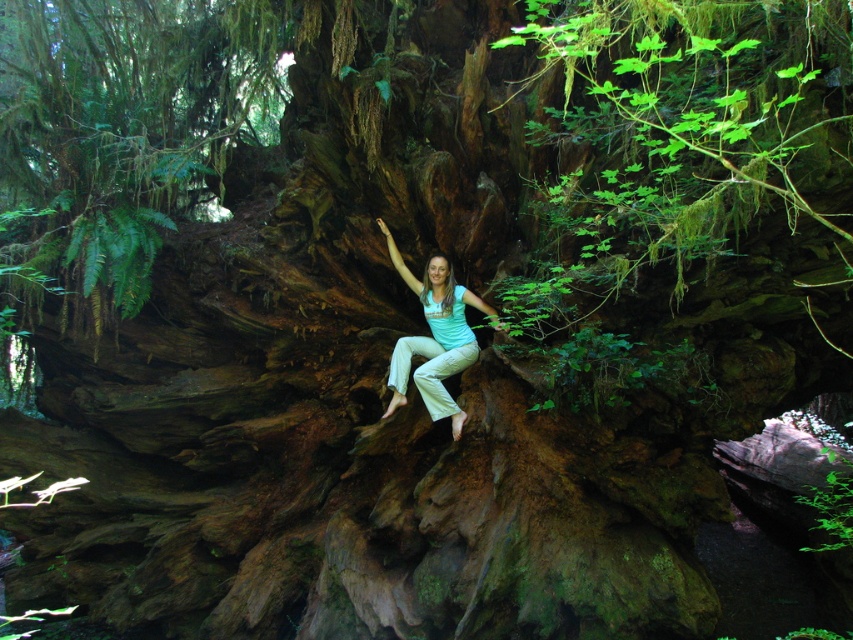
Is green mossy tree trunk at center positioned at the back of light blue cotton shirt at center?

No, it is in front of light blue cotton shirt at center.

Does point (97, 248) come farther from viewer compared to point (431, 294)?

That is False.

Between point (51, 180) and point (445, 273), which one is positioned in front?

Point (445, 273) is more forward.

At what (x,y) coordinates should I click in order to perform the action: click on green mossy tree trunk at center. Please return your answer as a coordinate pair (x, y). The width and height of the screenshot is (853, 640). Looking at the image, I should click on (120, 136).